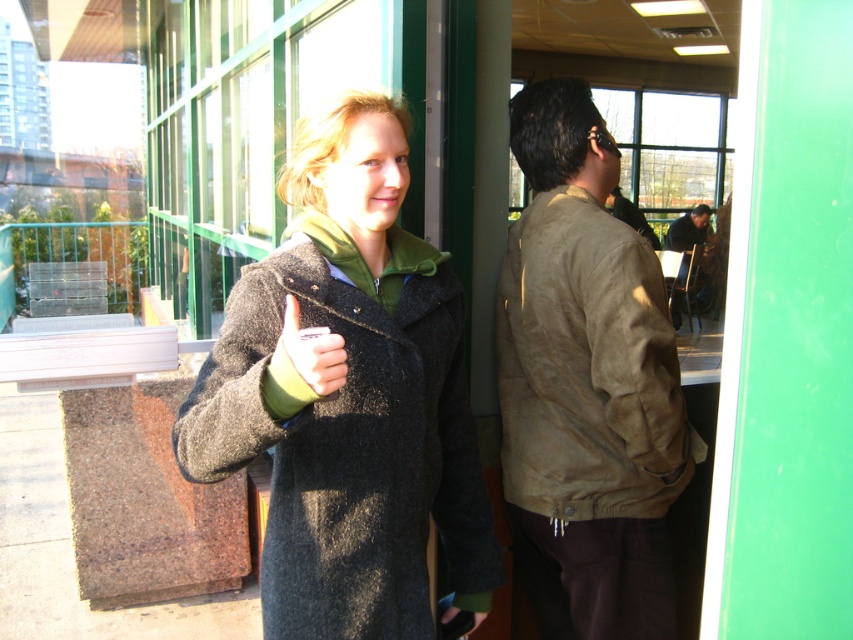
Can you confirm if dark gray wool coat at center is wider than brown suede jacket at right?

Correct, the width of dark gray wool coat at center exceeds that of brown suede jacket at right.

Who is higher up, dark gray wool coat at center or brown suede jacket at right?

Positioned higher is brown suede jacket at right.

The image size is (853, 640). What do you see at coordinates (347, 396) in the screenshot?
I see `dark gray wool coat at center` at bounding box center [347, 396].

The height and width of the screenshot is (640, 853). I want to click on dark gray wool coat at center, so pos(347,396).